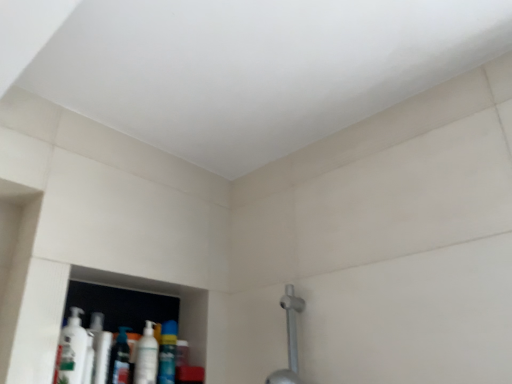
Question: Which is correct: blue glossy mouthwash at lower left, the 1th mouthwash when ordered from right to left, is inside white glossy mouthwash at lower left, acting as the third mouthwash starting from the left, or outside of it?

Choices:
 (A) outside
 (B) inside

Answer: (A)

Question: Relative to white glossy mouthwash at lower left, acting as the third mouthwash starting from the left, is blue glossy mouthwash at lower left, which appears as the 4th mouthwash when viewed from the left, in front or behind?

Choices:
 (A) behind
 (B) front

Answer: (A)

Question: Considering the real-world distances, which object is farthest from the blue glossy mouthwash at lower left, which appears as the 4th mouthwash when viewed from the left?

Choices:
 (A) white glossy mouthwash at lower left, which is the 2th mouthwash in right-to-left order
 (B) translucent plastic mouthwash at lower left, which is the second mouthwash in left-to-right order
 (C) white glossy mouthwash at lower left, acting as the 4th mouthwash starting from the right
 (D) silver metallic shower at lower right

Answer: (D)

Question: Which is farther from the translucent plastic mouthwash at lower left, which is the second mouthwash in left-to-right order?

Choices:
 (A) blue glossy mouthwash at lower left, the 1th mouthwash when ordered from right to left
 (B) white glossy mouthwash at lower left, arranged as the 1th mouthwash when viewed from the left
 (C) silver metallic shower at lower right
 (D) white glossy mouthwash at lower left, acting as the third mouthwash starting from the left

Answer: (C)